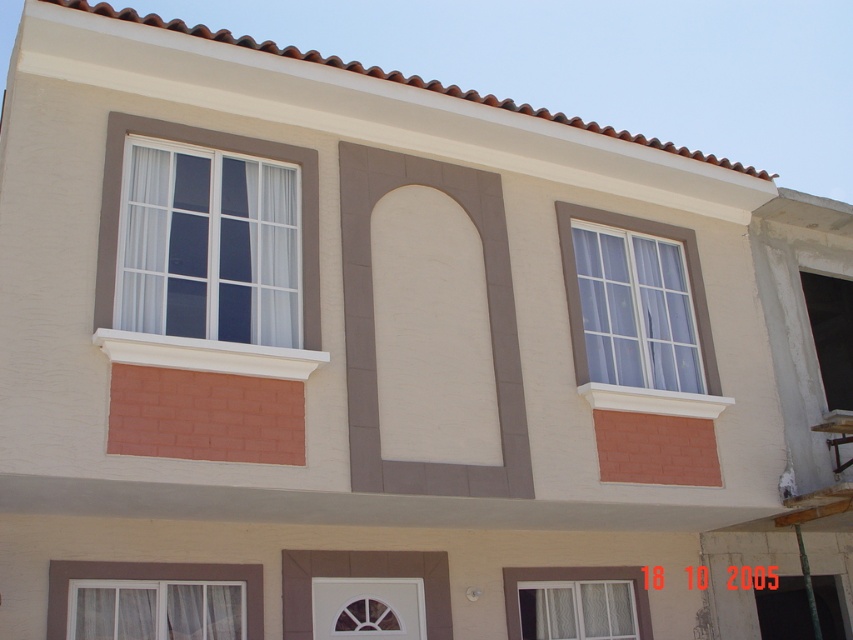
You are a delivery person trying to locate the entrance to the house. You see the white textured window at lower right and the matte glass window at upper right. Which window is closer to the entrance door?

The white textured window at lower right is positioned on the left side of matte glass window at upper right. Since the entrance door is typically located on the lower level, the white textured window at lower right is closer to the entrance door.

You are a painter standing at the front of the house. You need to paint the white textured window at lower right and the white glass window at upper right. Which window should you paint first if you want to paint the one that is closer to you first?

You should paint the white textured window at lower right first because it is closer to you than the white glass window at upper right, which is behind it.